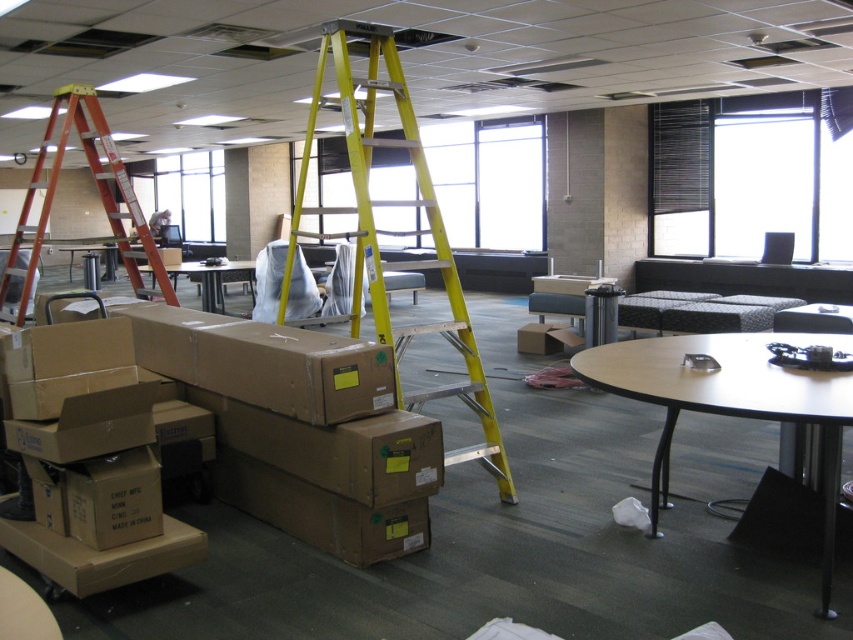
Question: Is yellow metallic ladder at center positioned in front of black plastic table at lower right?

Choices:
 (A) yes
 (B) no

Answer: (B)

Question: Which object is positioned closest to the black plastic table at lower right?

Choices:
 (A) yellow metallic ladder at center
 (B) orange metallic ladder at left
 (C) matte cardboard table at center

Answer: (A)

Question: Among these objects, which one is nearest to the camera?

Choices:
 (A) yellow metallic ladder at center
 (B) black plastic table at lower right
 (C) matte cardboard table at center

Answer: (B)

Question: Which object is the farthest from the yellow metallic ladder at center?

Choices:
 (A) orange metallic ladder at left
 (B) matte cardboard table at center
 (C) black plastic table at lower right

Answer: (B)

Question: In this image, where is yellow metallic ladder at center located relative to black plastic table at lower right?

Choices:
 (A) below
 (B) above

Answer: (A)

Question: Does yellow metallic ladder at center have a smaller size compared to matte cardboard table at center?

Choices:
 (A) no
 (B) yes

Answer: (B)